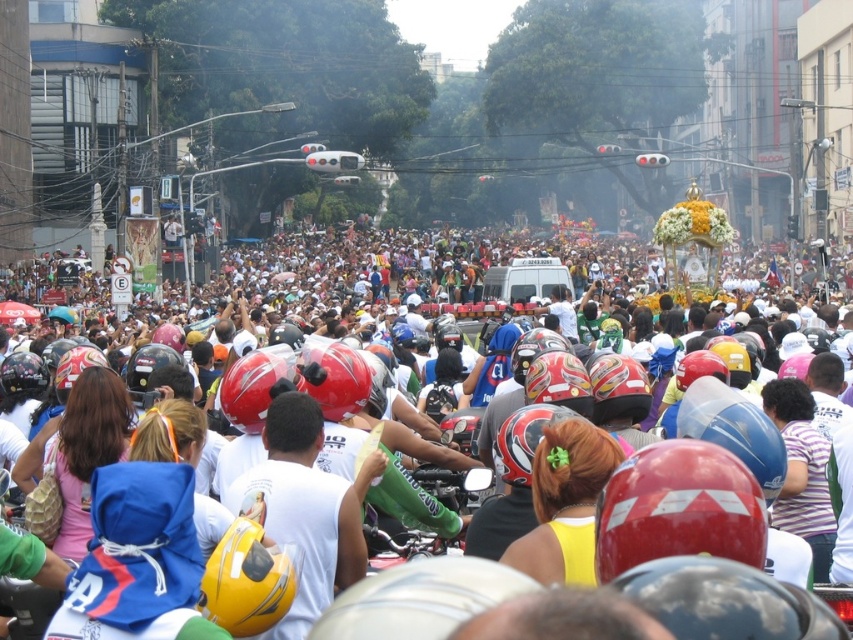
Is green matte motorcycle at center thinner than glossy red helmet at center?

Yes.

Is green matte motorcycle at center shorter than glossy red helmet at center?

Correct, green matte motorcycle at center is not as tall as glossy red helmet at center.

Who is more forward, (433, 518) or (521, 477)?

Point (521, 477) is more forward.

Find the location of `green matte motorcycle at center`. green matte motorcycle at center is located at coordinates (418, 513).

Does white matte helmet at center have a greater width compared to green matte motorcycle at center?

In fact, white matte helmet at center might be narrower than green matte motorcycle at center.

Is white matte helmet at center to the left of green matte motorcycle at center from the viewer's perspective?

Correct, you'll find white matte helmet at center to the left of green matte motorcycle at center.

Image resolution: width=853 pixels, height=640 pixels. What do you see at coordinates (302, 509) in the screenshot?
I see `white matte helmet at center` at bounding box center [302, 509].

The width and height of the screenshot is (853, 640). I want to click on white matte helmet at center, so click(x=302, y=509).

Which of these two, decorative float at center or white matte helmet at center, stands shorter?

white matte helmet at center

Can you confirm if decorative float at center is wider than white matte helmet at center?

Indeed, decorative float at center has a greater width compared to white matte helmet at center.

Does point (641, 371) come closer to viewer compared to point (297, 628)?

No, (641, 371) is behind (297, 628).

The image size is (853, 640). Identify the location of decorative float at center. (302, 280).